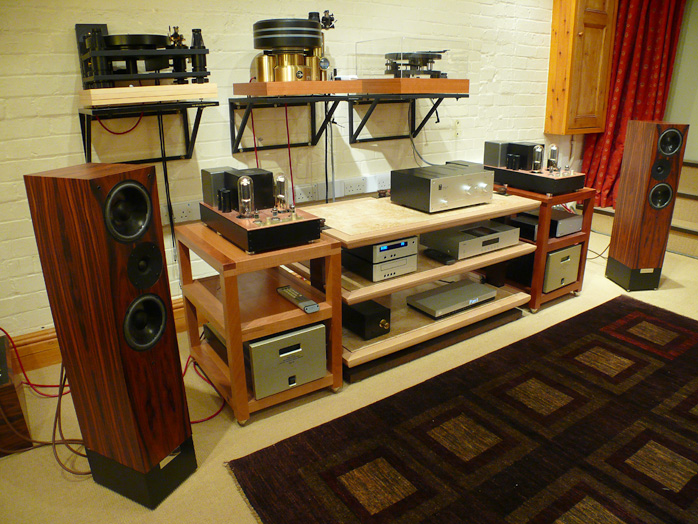
This screenshot has height=524, width=698. What are the coordinates of `wall cabinet` in the screenshot? It's located at coord(576,83).